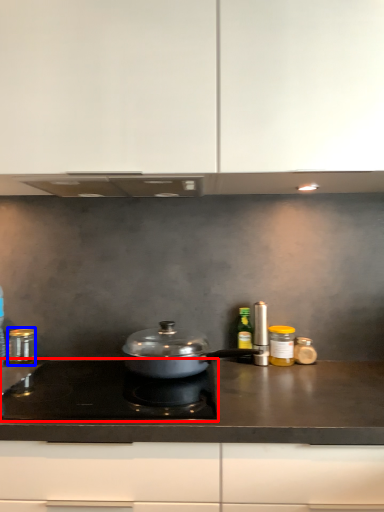
Question: Which point is further to the camera, gas stove (highlighted by a red box) or kitchen appliance (highlighted by a blue box)?

Choices:
 (A) gas stove
 (B) kitchen appliance

Answer: (B)